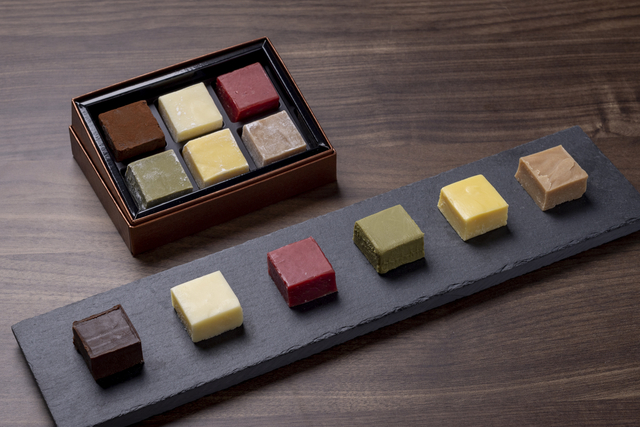
Where is `table`? Image resolution: width=640 pixels, height=427 pixels. table is located at coordinates (498, 359).